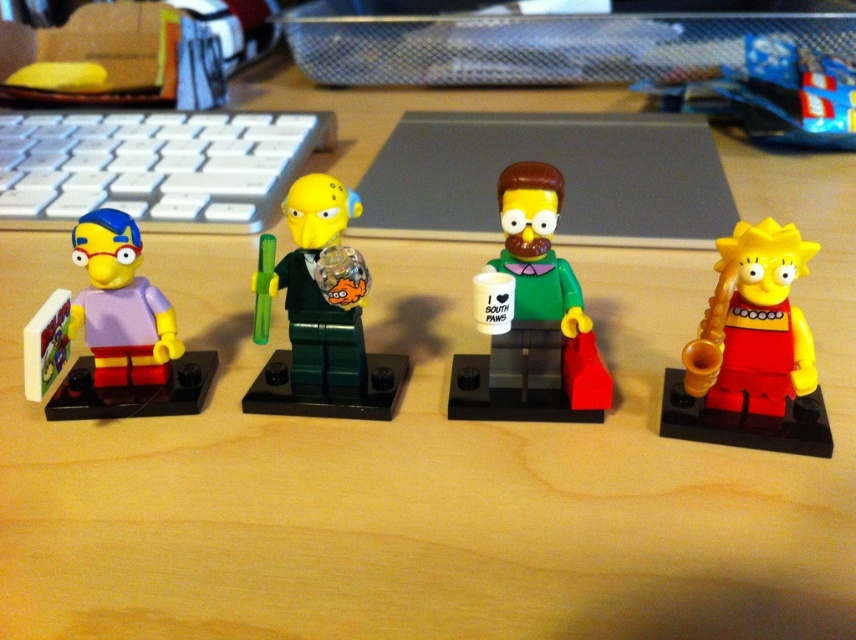
Question: Which object appears farthest from the camera in this image?

Choices:
 (A) matte yellow saxophone at right
 (B) green plastic/transparent figurine at center
 (C) matte purple plastic toy at left

Answer: (C)

Question: Is matte purple plastic toy at left above blue plastic bag at upper center?

Choices:
 (A) yes
 (B) no

Answer: (B)

Question: Considering the real-world distances, which object is farthest from the blue plastic bag at upper center?

Choices:
 (A) white plastic keyboard at upper left
 (B) matte purple plastic toy at left
 (C) green matte figure at center
 (D) matte yellow saxophone at right

Answer: (B)

Question: Is white plastic keyboard at upper left wider than matte purple plastic toy at left?

Choices:
 (A) yes
 (B) no

Answer: (A)

Question: Which of the following is the farthest from the observer?

Choices:
 (A) (248, 410)
 (B) (771, 84)

Answer: (B)

Question: Can you confirm if matte yellow saxophone at right is positioned to the right of green matte figure at center?

Choices:
 (A) yes
 (B) no

Answer: (A)